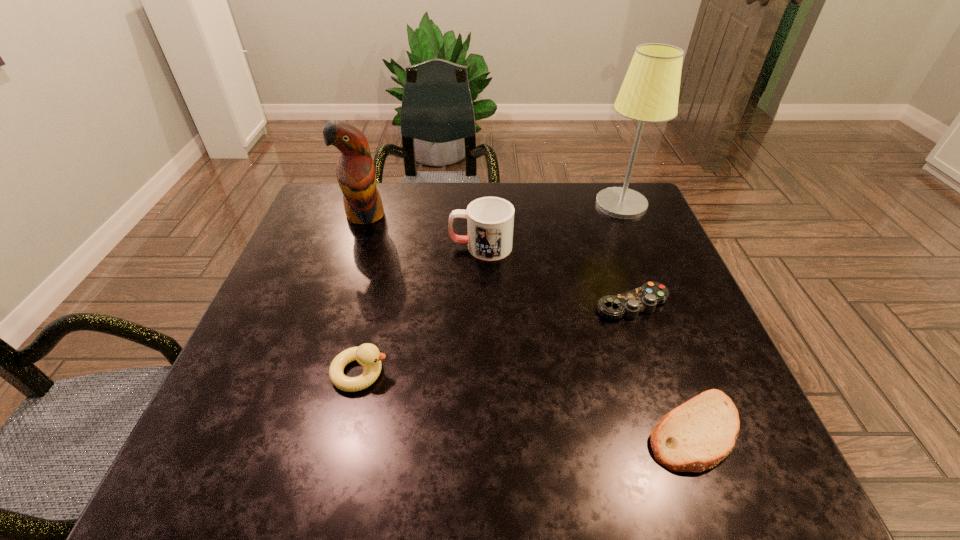
Select which object appears as the fifth closest to the table lamp. Please provide its 2D coordinates. Your answer should be formatted as a tuple, i.e. [(x, y)], where the tuple contains the x and y coordinates of a point satisfying the conditions above.

[(368, 355)]

This screenshot has width=960, height=540. I want to click on free location that satisfies the following two spatial constraints: 1. on the face of the fifth shortest object; 2. on the left side of the third nearest object, so click(336, 304).

Where is `free space that satisfies the following two spatial constraints: 1. on the back side of the third nearest object; 2. on the side of the third tallest object with the handle`? The width and height of the screenshot is (960, 540). free space that satisfies the following two spatial constraints: 1. on the back side of the third nearest object; 2. on the side of the third tallest object with the handle is located at coordinates (612, 246).

I want to click on vacant point that satisfies the following two spatial constraints: 1. on the front side of the table lamp; 2. on the side of the mug with the handle, so click(x=638, y=246).

This screenshot has width=960, height=540. In order to click on free space in the image that satisfies the following two spatial constraints: 1. on the side of the third nearest object with the handle; 2. on the left side of the fourth nearest object in this screenshot , I will do `click(481, 304)`.

Locate an element on the screen. The height and width of the screenshot is (540, 960). vacant space that satisfies the following two spatial constraints: 1. on the face of the pita bread; 2. on the left side of the fifth shortest object is located at coordinates (294, 430).

Where is `free space that satisfies the following two spatial constraints: 1. on the face of the pita bread; 2. on the left side of the second tallest object`? free space that satisfies the following two spatial constraints: 1. on the face of the pita bread; 2. on the left side of the second tallest object is located at coordinates click(294, 430).